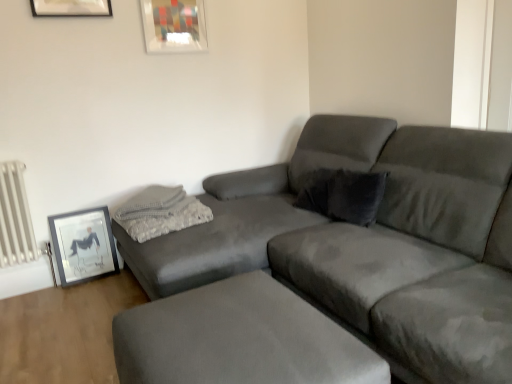
Question: Is matte glass picture frame at upper center, which is the first picture frame from top to bottom, positioned in front of velvet gray pillow at upper right, marked as the first pillow in a right-to-left arrangement?

Choices:
 (A) yes
 (B) no

Answer: (B)

Question: Does matte glass picture frame at upper center, which is counted as the 1th picture frame, starting from the right, have a lesser width compared to velvet gray pillow at upper right, marked as the 2th pillow in a left-to-right arrangement?

Choices:
 (A) yes
 (B) no

Answer: (A)

Question: Is matte glass picture frame at upper center, the 2th picture frame viewed from the left, outside of velvet gray pillow at upper right, marked as the 2th pillow in a left-to-right arrangement?

Choices:
 (A) no
 (B) yes

Answer: (B)

Question: From a real-world perspective, is matte glass picture frame at upper center, which is counted as the 1th picture frame, starting from the right, below velvet gray pillow at upper right, marked as the 2th pillow in a left-to-right arrangement?

Choices:
 (A) no
 (B) yes

Answer: (A)

Question: Considering the relative positions of matte glass picture frame at upper center, the 2th picture frame viewed from the left, and velvet gray pillow at upper right, marked as the 2th pillow in a left-to-right arrangement, in the image provided, is matte glass picture frame at upper center, the 2th picture frame viewed from the left, to the left of velvet gray pillow at upper right, marked as the 2th pillow in a left-to-right arrangement, from the viewer's perspective?

Choices:
 (A) no
 (B) yes

Answer: (B)

Question: Considering the relative sizes of matte glass picture frame at upper center, which is the first picture frame from top to bottom, and velvet gray pillow at upper right, marked as the 2th pillow in a left-to-right arrangement, in the image provided, is matte glass picture frame at upper center, which is the first picture frame from top to bottom, bigger than velvet gray pillow at upper right, marked as the 2th pillow in a left-to-right arrangement,?

Choices:
 (A) yes
 (B) no

Answer: (B)

Question: Can suede footrest at lower center be found inside velvet gray pillow at upper right, marked as the first pillow in a right-to-left arrangement?

Choices:
 (A) no
 (B) yes

Answer: (A)

Question: Is velvet gray pillow at upper right, marked as the first pillow in a right-to-left arrangement, touching suede footrest at lower center?

Choices:
 (A) yes
 (B) no

Answer: (B)

Question: Can you confirm if velvet gray pillow at upper right, marked as the first pillow in a right-to-left arrangement, is thinner than suede footrest at lower center?

Choices:
 (A) yes
 (B) no

Answer: (A)

Question: Does velvet gray pillow at upper right, marked as the 2th pillow in a left-to-right arrangement, appear on the left side of suede footrest at lower center?

Choices:
 (A) no
 (B) yes

Answer: (A)

Question: Is there a large distance between velvet gray pillow at upper right, marked as the 2th pillow in a left-to-right arrangement, and suede footrest at lower center?

Choices:
 (A) no
 (B) yes

Answer: (A)

Question: Could you tell me if velvet gray pillow at upper right, marked as the 2th pillow in a left-to-right arrangement, is turned towards suede footrest at lower center?

Choices:
 (A) no
 (B) yes

Answer: (B)

Question: From a real-world perspective, is suede gray couch at center positioned over white metallic radiator at left based on gravity?

Choices:
 (A) no
 (B) yes

Answer: (B)